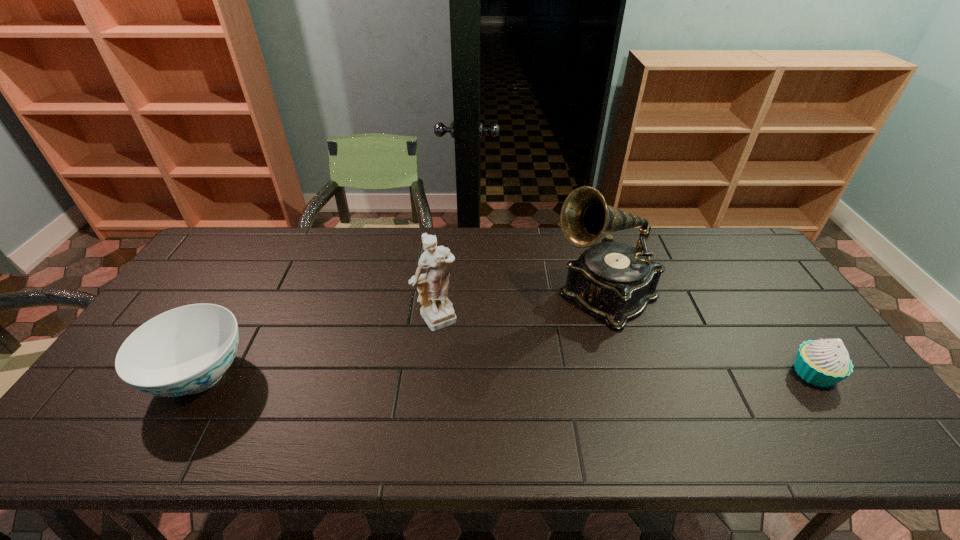
The width and height of the screenshot is (960, 540). I want to click on vacant point located between the rightmost object and the leftmost object, so pyautogui.click(x=507, y=374).

Where is `free spot between the chinaware and the cupcake`? This screenshot has height=540, width=960. free spot between the chinaware and the cupcake is located at coordinates (507, 374).

The image size is (960, 540). Find the location of `vacant area between the leftmost object and the phonograph record`. vacant area between the leftmost object and the phonograph record is located at coordinates (402, 335).

Find the location of `vacant space that's between the rightmost object and the leftmost object`. vacant space that's between the rightmost object and the leftmost object is located at coordinates (507, 374).

Identify the location of blank region between the second tallest object and the rightmost object. (626, 346).

At what (x,y) coordinates should I click in order to perform the action: click on vacant area between the tallest object and the cupcake. Please return your answer as a coordinate pair (x, y). The width and height of the screenshot is (960, 540). Looking at the image, I should click on (708, 334).

Locate which object is the third closest to the chinaware. Please provide its 2D coordinates. Your answer should be formatted as a tuple, i.e. [(x, y)], where the tuple contains the x and y coordinates of a point satisfying the conditions above.

[(823, 363)]

At what (x,y) coordinates should I click in order to perform the action: click on the closest object relative to the figurine. Please return your answer as a coordinate pair (x, y). Image resolution: width=960 pixels, height=540 pixels. Looking at the image, I should click on (614, 281).

Locate an element on the screen. The height and width of the screenshot is (540, 960). vacant space that satisfies the following two spatial constraints: 1. on the back side of the tallest object; 2. on the left side of the chinaware is located at coordinates (247, 295).